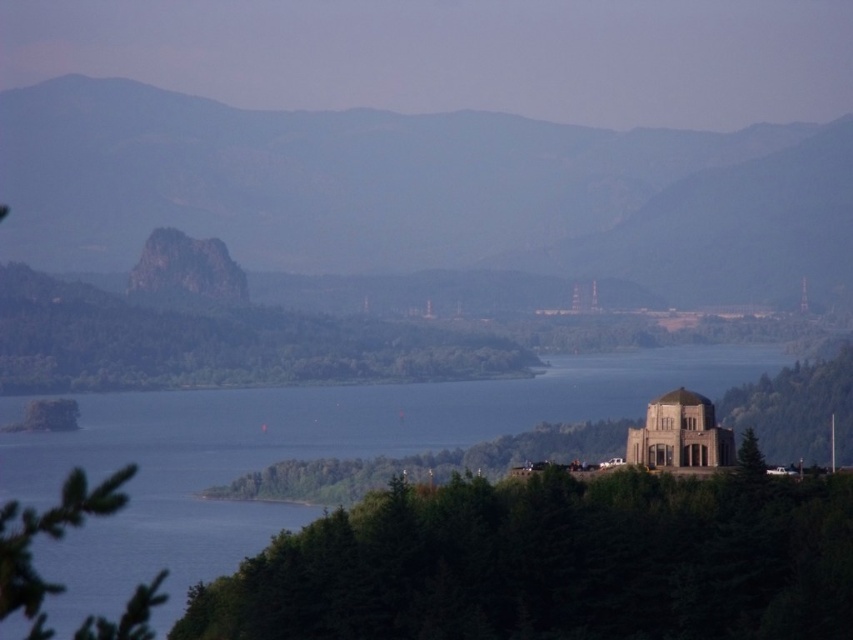
Who is positioned more to the right, rugged granite rock at center or blue water at center?

Positioned to the right is rugged granite rock at center.

Which is in front, point (387, 248) or point (612, 396)?

Point (387, 248) is more forward.

Where is `rugged granite rock at center`? rugged granite rock at center is located at coordinates (424, 193).